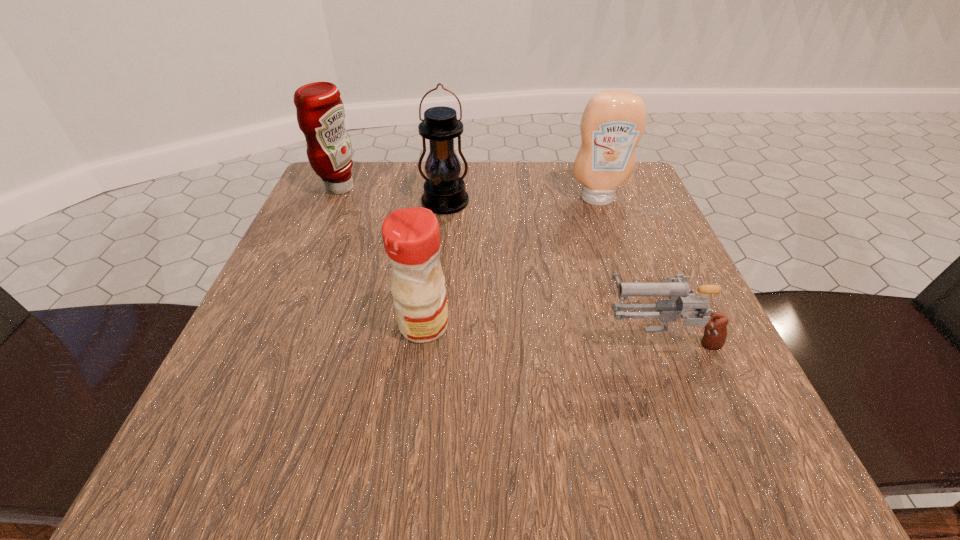
This screenshot has height=540, width=960. In order to click on vacant space at the left edge of the desktop in this screenshot , I will do `click(347, 244)`.

The image size is (960, 540). Find the location of `free location at the right edge`. free location at the right edge is located at coordinates (607, 251).

Locate an element on the screen. vacant area at the far left corner is located at coordinates (357, 181).

The width and height of the screenshot is (960, 540). I want to click on vacant region at the near left corner of the desktop, so click(204, 475).

Where is `vacant region at the far right corner of the desktop`? vacant region at the far right corner of the desktop is located at coordinates (628, 180).

Where is `vacant space at the near right corner of the desktop`? Image resolution: width=960 pixels, height=540 pixels. vacant space at the near right corner of the desktop is located at coordinates (774, 442).

Where is `free point between the gun and the leftmost condiment`? Image resolution: width=960 pixels, height=540 pixels. free point between the gun and the leftmost condiment is located at coordinates tap(499, 262).

The height and width of the screenshot is (540, 960). In order to click on free space between the rightmost condiment and the second condiment from left to right in this screenshot , I will do `click(511, 262)`.

I want to click on blank region between the second condiment from left to right and the rightmost condiment, so click(511, 262).

Where is `vacant area between the shortest object and the lantern`? The image size is (960, 540). vacant area between the shortest object and the lantern is located at coordinates (552, 270).